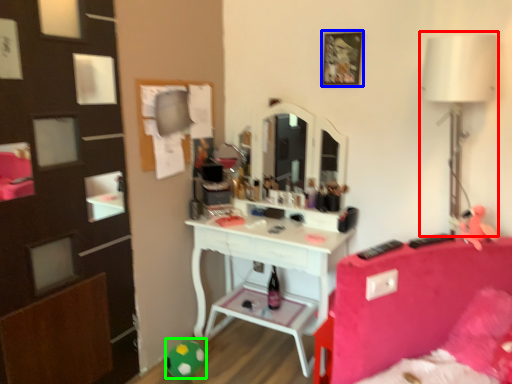
Question: Which object is positioned farthest from table lamp (highlighted by a red box)? Select from picture frame (highlighted by a blue box) and toy (highlighted by a green box).

Choices:
 (A) picture frame
 (B) toy

Answer: (B)